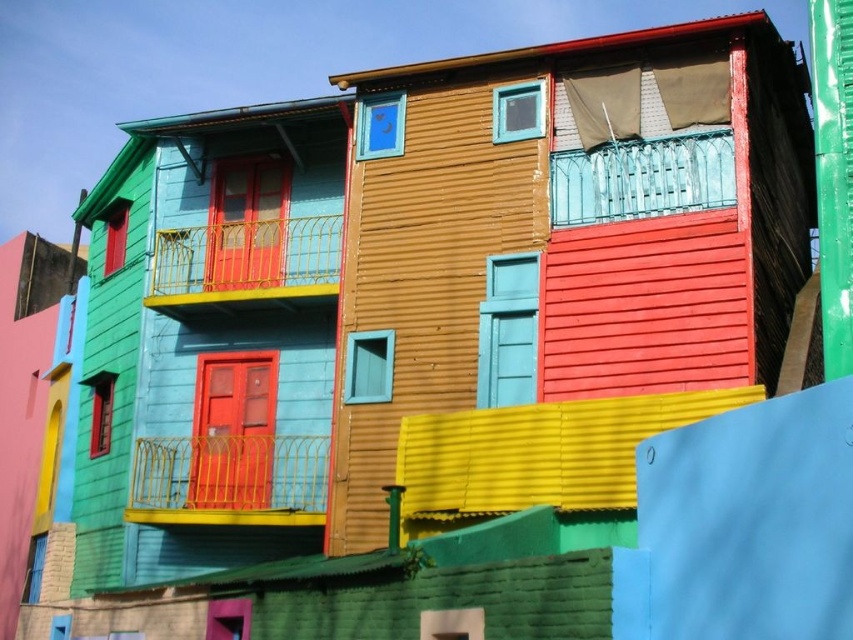
You are an architect examining the building and want to know the spatial relationship between the yellow metal railing at upper center and the teal glass railing at upper center. Which one is located above the other?

The yellow metal railing at upper center is positioned under the teal glass railing at upper center, meaning the teal glass railing is above it.